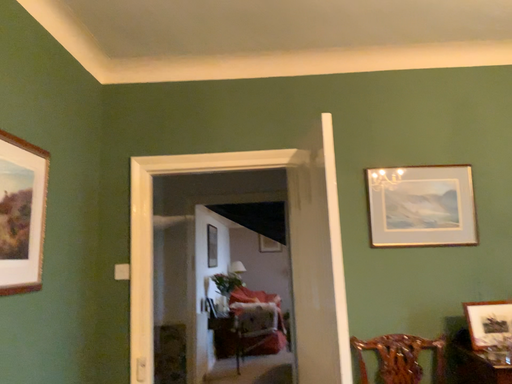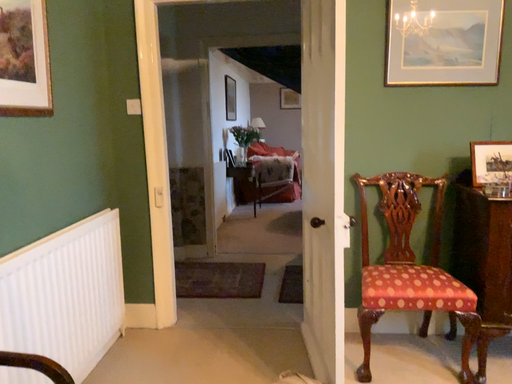
Question: Which way did the camera rotate in the video?

Choices:
 (A) rotated upward
 (B) rotated downward

Answer: (B)